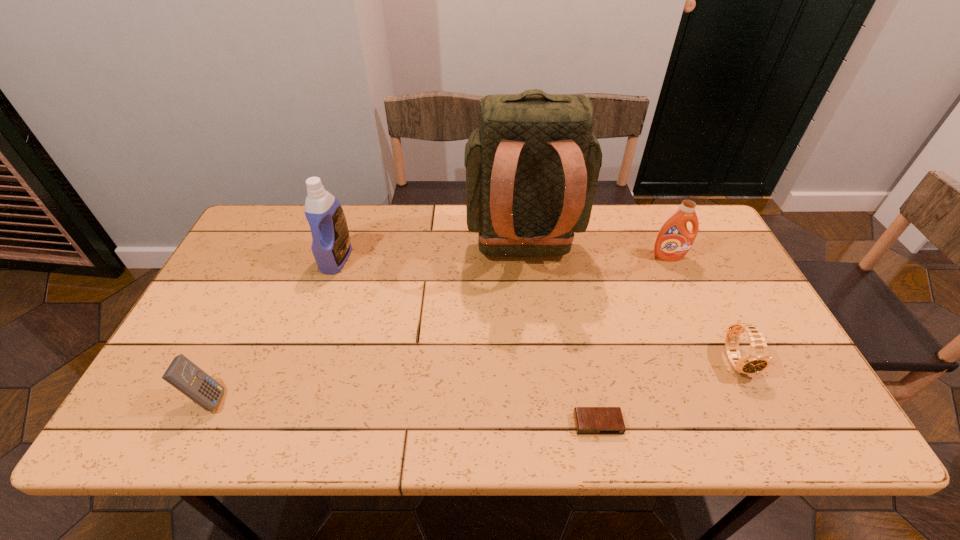
At what (x,y) coordinates should I click in order to perform the action: click on free location located on the front of the taller detergent. Please return your answer as a coordinate pair (x, y). Image resolution: width=960 pixels, height=540 pixels. Looking at the image, I should click on (x=318, y=313).

In order to click on vacant point located on the front-facing side of the right detergent in this screenshot , I will do `click(719, 370)`.

This screenshot has height=540, width=960. Identify the location of free location located 0.400m on the front-facing side of the leftmost object. (401, 399).

This screenshot has width=960, height=540. Identify the location of free space located on the face of the third nearest object. (756, 400).

Identify the location of backpack that is positioned at the far edge. point(532,169).

Where is `detergent present at the far edge`? This screenshot has width=960, height=540. detergent present at the far edge is located at coordinates (331, 247).

This screenshot has width=960, height=540. What are the coordinates of `calculator positioned at the near edge` in the screenshot? It's located at click(183, 374).

Locate an element on the screen. Image resolution: width=960 pixels, height=540 pixels. alarm clock that is at the near edge is located at coordinates (588, 420).

Locate an element on the screen. This screenshot has height=540, width=960. object that is at the left edge is located at coordinates (183, 374).

Locate an element on the screen. The height and width of the screenshot is (540, 960). detergent that is positioned at the right edge is located at coordinates (674, 240).